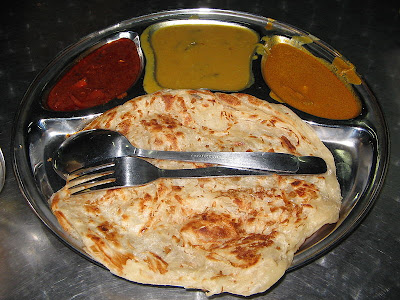
This screenshot has width=400, height=300. I want to click on shadow on table, so click(69, 13), click(349, 10).